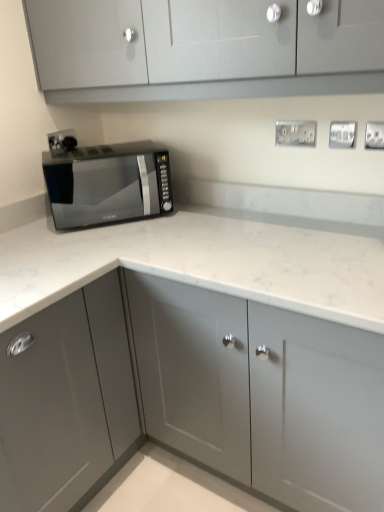
Question: From a real-world perspective, is black plastic socket at upper left, which is counted as the 1th electric outlet, starting from the back, positioned above or below silver metallic electric outlet at upper right, which is the 2th electric outlet in right-to-left order?

Choices:
 (A) above
 (B) below

Answer: (B)

Question: Is black plastic socket at upper left, which ranks as the fourth electric outlet in front-to-back order, wider or thinner than silver metallic electric outlet at upper right, acting as the 2th electric outlet starting from the front?

Choices:
 (A) thin
 (B) wide

Answer: (A)

Question: Which object is positioned farthest from the satin silver outlet at upper right, which ranks as the fourth electric outlet in back-to-front order?

Choices:
 (A) black plastic socket at upper left, which is counted as the 1th electric outlet, starting from the back
 (B) matte gray cabinet at upper center, positioned as the 1th cabinetry in top-to-bottom order
 (C) black glass microwave at left
 (D) silver metallic electric outlet at upper right, which is the 2th electric outlet in right-to-left order
 (E) matte gray cabinet at center, placed as the 2th cabinetry when sorted from bottom to top

Answer: (A)

Question: Which is nearer to the black glass microwave at left?

Choices:
 (A) satin silver outlet at upper right, which ranks as the fourth electric outlet in back-to-front order
 (B) satin silver electrical outlet at upper center, which is counted as the 2th electric outlet, starting from the left
 (C) matte gray cabinet at upper center, positioned as the 1th cabinetry in top-to-bottom order
 (D) black plastic socket at upper left, placed as the 4th electric outlet when sorted from right to left
 (E) silver metallic electric outlet at upper right, which is the 3th electric outlet from left to right

Answer: (D)